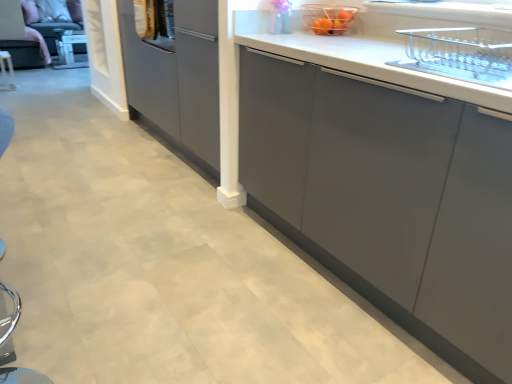
Question: Would you say translucent plastic basket at upper center is part of metallic silver knife at left's contents?

Choices:
 (A) yes
 (B) no

Answer: (B)

Question: Is metallic silver knife at left aimed at translucent plastic basket at upper center?

Choices:
 (A) yes
 (B) no

Answer: (B)

Question: Considering the relative positions of metallic silver knife at left and translucent plastic basket at upper center in the image provided, is metallic silver knife at left to the left of translucent plastic basket at upper center from the viewer's perspective?

Choices:
 (A) no
 (B) yes

Answer: (B)

Question: Is metallic silver knife at left beside translucent plastic basket at upper center?

Choices:
 (A) no
 (B) yes

Answer: (A)

Question: Is translucent plastic basket at upper center at the back of metallic silver knife at left?

Choices:
 (A) yes
 (B) no

Answer: (B)

Question: Does metallic silver knife at left have a smaller size compared to translucent plastic basket at upper center?

Choices:
 (A) yes
 (B) no

Answer: (B)

Question: Is translucent plastic basket at upper center wider than metallic silver knife at left?

Choices:
 (A) yes
 (B) no

Answer: (A)

Question: Would you consider translucent plastic basket at upper center to be distant from metallic silver knife at left?

Choices:
 (A) yes
 (B) no

Answer: (A)

Question: Is translucent plastic basket at upper center positioned beyond the bounds of metallic silver knife at left?

Choices:
 (A) yes
 (B) no

Answer: (A)

Question: Can metallic silver knife at left be found inside translucent plastic basket at upper center?

Choices:
 (A) yes
 (B) no

Answer: (B)

Question: Is the depth of translucent plastic basket at upper center less than that of metallic silver knife at left?

Choices:
 (A) no
 (B) yes

Answer: (B)

Question: Does translucent plastic basket at upper center have a larger size compared to metallic silver knife at left?

Choices:
 (A) yes
 (B) no

Answer: (B)

Question: From a real-world perspective, is metallic silver knife at left positioned above or below translucent plastic basket at upper center?

Choices:
 (A) below
 (B) above

Answer: (A)